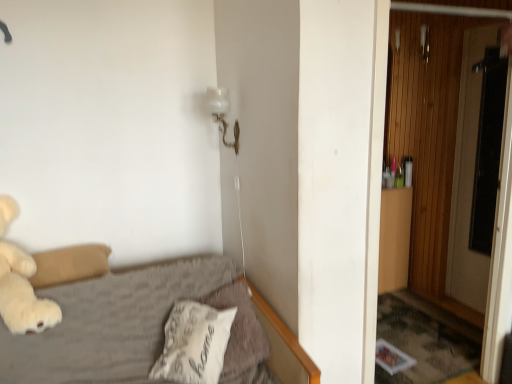
Question: Does white soft pillow at lower center, which appears as the second pillow when viewed from the left, have a smaller size compared to white soft pillow at lower center, the 1th pillow when ordered from left to right?

Choices:
 (A) yes
 (B) no

Answer: (B)

Question: Does white soft pillow at lower center, which is the 1th pillow from right to left, turn towards white soft pillow at lower center, the 1th pillow when ordered from left to right?

Choices:
 (A) yes
 (B) no

Answer: (A)

Question: Would you say white soft pillow at lower center, which appears as the second pillow when viewed from the left, contains white soft pillow at lower center, the 2th pillow from the right?

Choices:
 (A) no
 (B) yes

Answer: (B)

Question: Is white soft pillow at lower center, which appears as the second pillow when viewed from the left, completely or partially outside of white soft pillow at lower center, the 2th pillow from the right?

Choices:
 (A) yes
 (B) no

Answer: (B)

Question: From a real-world perspective, is white soft pillow at lower center, which is the 1th pillow from right to left, positioned under white soft pillow at lower center, the 2th pillow from the right, based on gravity?

Choices:
 (A) yes
 (B) no

Answer: (A)

Question: Is white soft pillow at lower center, which is the 1th pillow from right to left, next to white soft pillow at lower center, the 2th pillow from the right?

Choices:
 (A) yes
 (B) no

Answer: (B)

Question: Is white soft pillow at lower center, which appears as the second pillow when viewed from the left, shorter than white plush teddy bear at left?

Choices:
 (A) yes
 (B) no

Answer: (A)

Question: From a real-world perspective, does white soft pillow at lower center, which appears as the second pillow when viewed from the left, stand above white plush teddy bear at left?

Choices:
 (A) no
 (B) yes

Answer: (A)

Question: Is white soft pillow at lower center, which is the 1th pillow from right to left, taller than white plush teddy bear at left?

Choices:
 (A) no
 (B) yes

Answer: (A)

Question: Is white soft pillow at lower center, which is the 1th pillow from right to left, not within white plush teddy bear at left?

Choices:
 (A) no
 (B) yes

Answer: (B)

Question: Could white plush teddy bear at left be considered to be inside white soft pillow at lower center, which is the 1th pillow from right to left?

Choices:
 (A) no
 (B) yes

Answer: (A)

Question: From the image's perspective, is white soft pillow at lower center, which appears as the second pillow when viewed from the left, over white plush teddy bear at left?

Choices:
 (A) yes
 (B) no

Answer: (B)

Question: Is white soft pillow at lower center, which is the 1th pillow from right to left, inside white glass lamp at upper center?

Choices:
 (A) yes
 (B) no

Answer: (B)